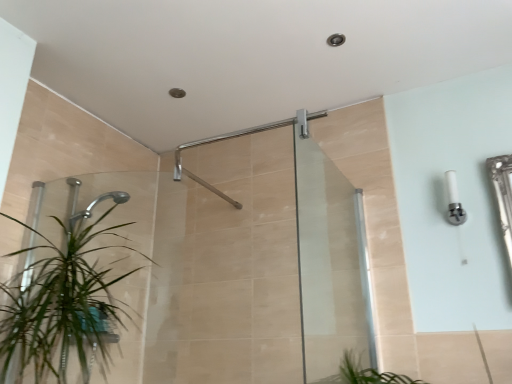
Question: Visually, is matte silver shower arm at upper center positioned to the left or to the right of green leafy plant at left?

Choices:
 (A) left
 (B) right

Answer: (B)

Question: From the image's perspective, is matte silver shower arm at upper center located above or below green leafy plant at left?

Choices:
 (A) below
 (B) above

Answer: (B)

Question: Estimate the real-world distances between objects in this image. Which object is farther from the matte silver shower arm at upper center?

Choices:
 (A) white plastic light fixture at upper right
 (B) transparent glass screen door at center
 (C) green leafy plant at left

Answer: (A)

Question: Which object is the closest to the green leafy plant at left?

Choices:
 (A) matte silver shower arm at upper center
 (B) transparent glass screen door at center
 (C) white plastic light fixture at upper right

Answer: (A)